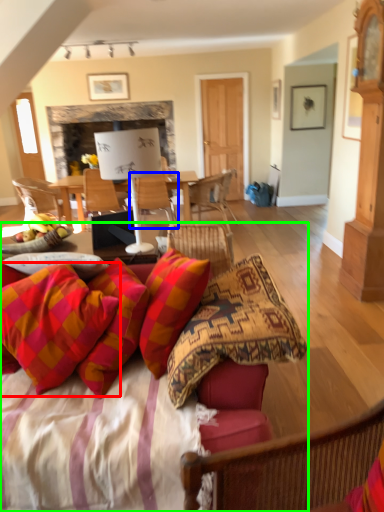
Question: Estimate the real-world distances between objects in this image. Which object is farther from pillow (highlighted by a red box), chair (highlighted by a blue box) or studio couch (highlighted by a green box)?

Choices:
 (A) chair
 (B) studio couch

Answer: (A)